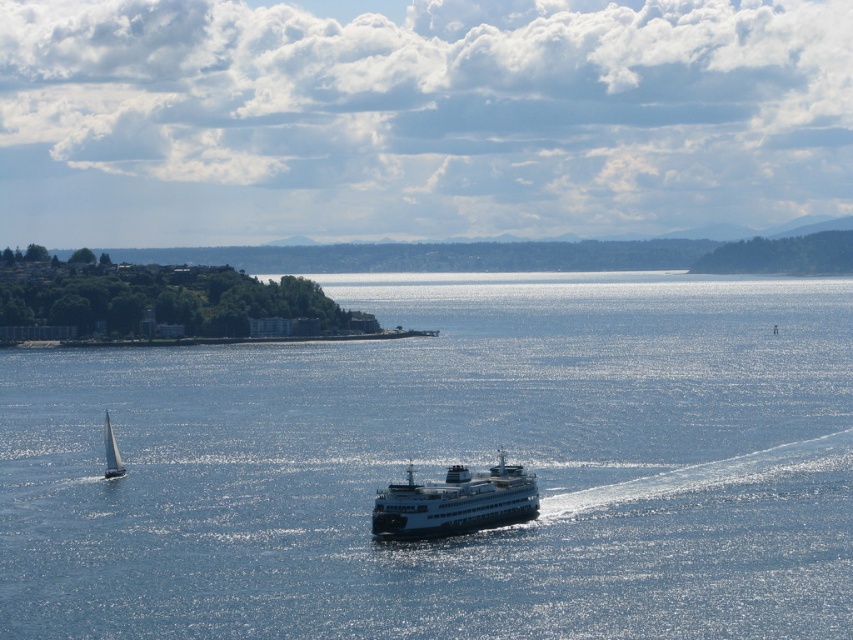
Looking at this image, you are a passenger on the white glossy ferry at center and want to see the white glossy sailboat at lower left. Based on their positions, can you see it from your current location on the ferry?

The white glossy ferry at center is positioned under the white glossy sailboat at lower left, so yes, you can see the white glossy sailboat at lower left from your current location on the ferry.

You are a photographer on a boat trying to capture the white glossy ferry at center and the blue water at center in your shot. Based on their positions, which object should you frame first to ensure both are in the same photo?

The blue water at center is to the left of the white glossy ferry at center, so you should frame the white glossy ferry at center first as it is positioned to the right, ensuring both objects are included in the photo.